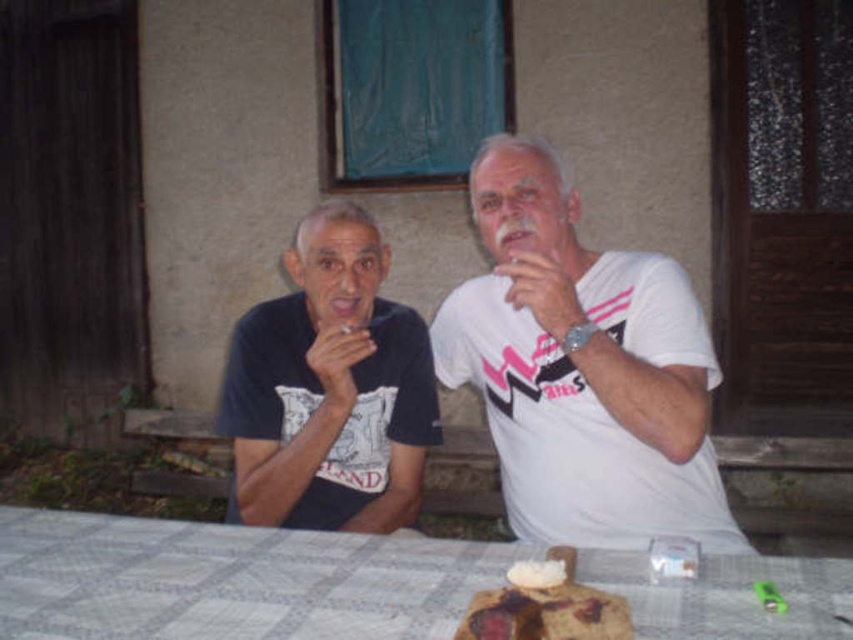
You are a photographer planning to set up a tripod to capture the scene of the two people talking at the table. The tripod requires a minimum of 1 meter of space in front of the white fabric table at center to avoid blocking the view. Can you determine if there is enough space based on the table coordinates provided?

The position of white fabric table at center is at point [230,580]. However, without knowing the scale or dimensions of the scene, it is impossible to determine if there is 1 meter of space in front of the table. Additional information about the scene size or the coordinate system is needed to make this assessment.